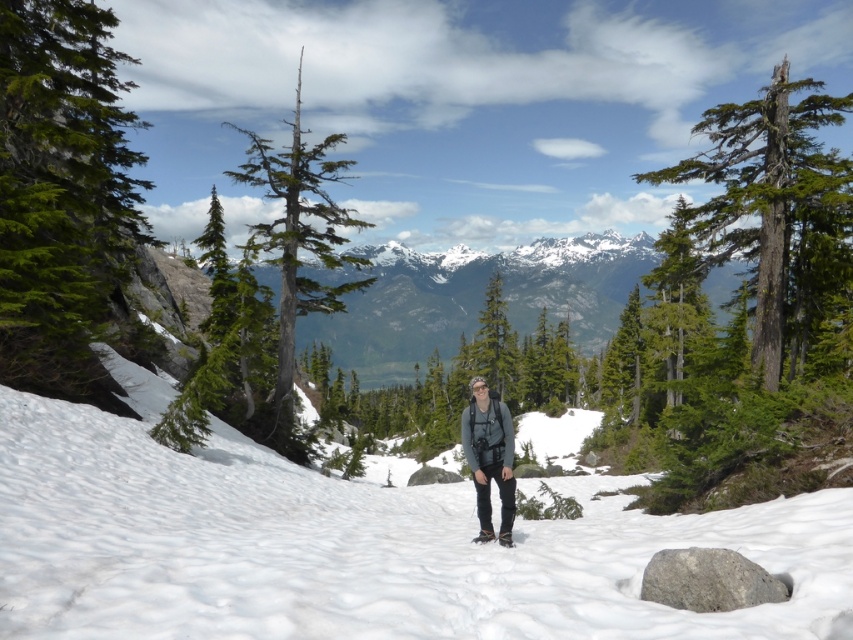
You are a hiker trying to navigate through the mountain trail. You see a green coniferous tree at left and a green textured tree at upper right. Which tree would you choose to use as a landmark for navigation and why?

The green textured tree at upper right is larger than the green coniferous tree at left, making it a better landmark for navigation due to its greater visibility and prominence in the landscape.